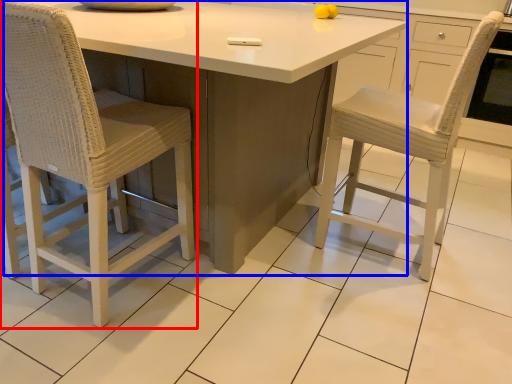
Question: Among these objects, which one is farthest to the camera, chair (highlighted by a red box) or table (highlighted by a blue box)?

Choices:
 (A) chair
 (B) table

Answer: (A)